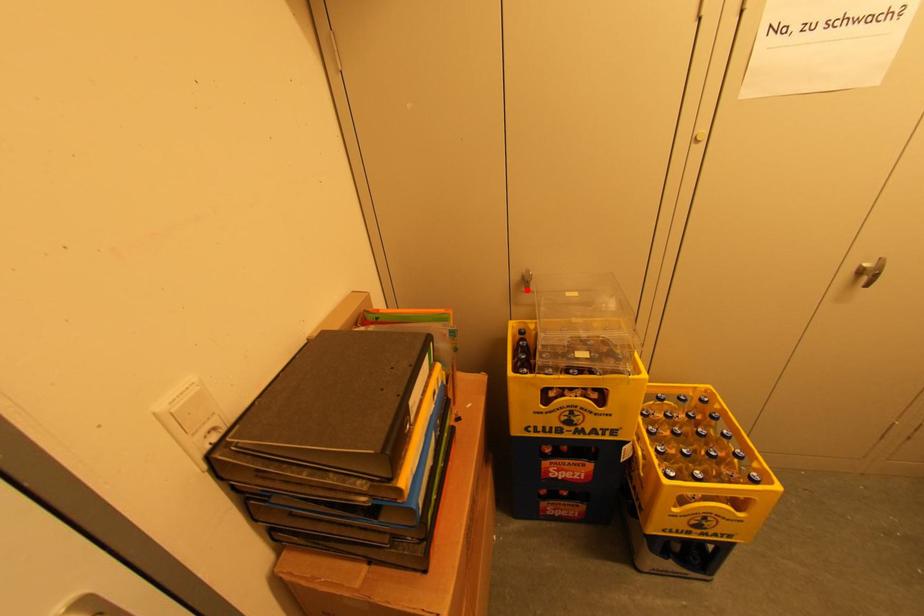
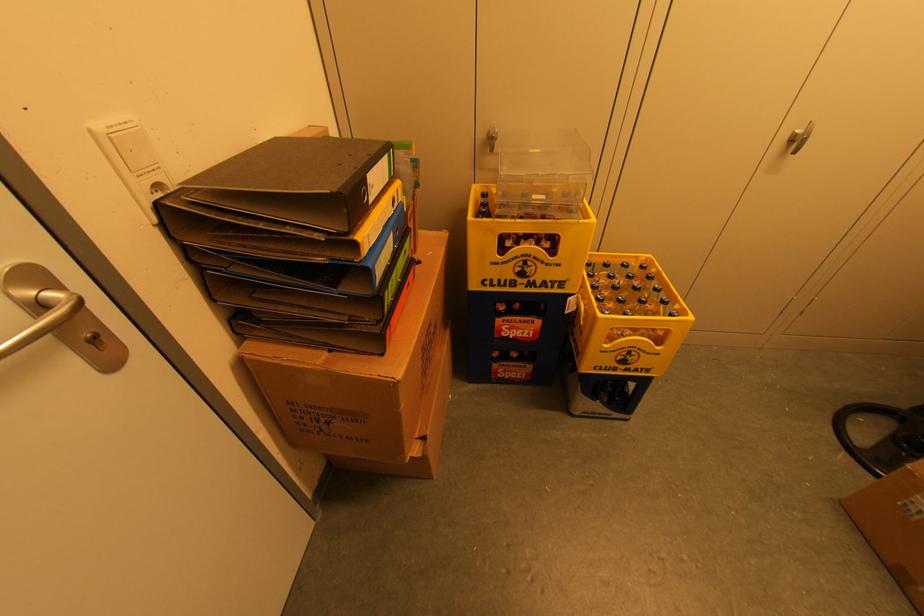
Question: I am providing you with two images of the same scene from different viewpoints. Image1 has a red point marked. In image2, the corresponding 3D location appears at what relative position? Reply with the corresponding letter.

Choices:
 (A) Closer
 (B) Farther

Answer: (A)